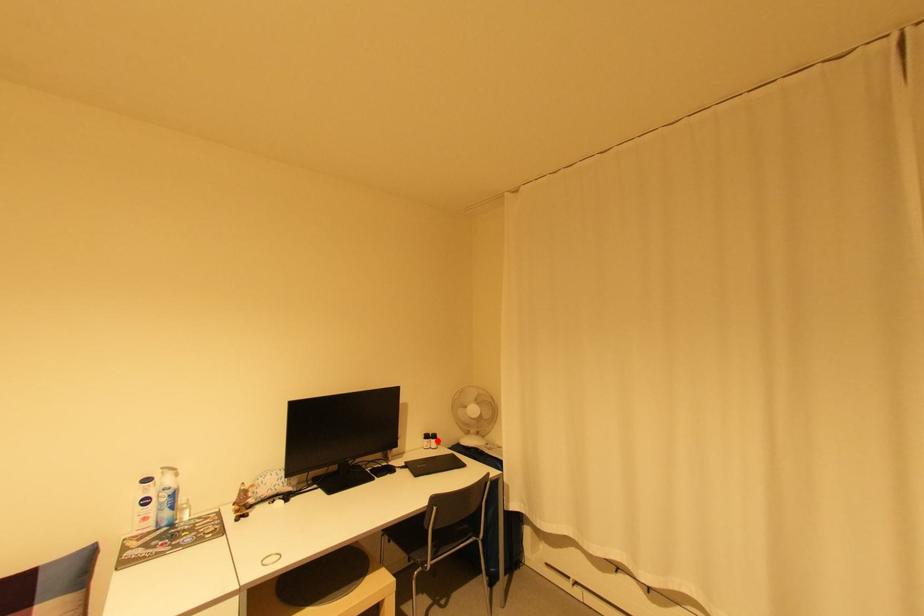
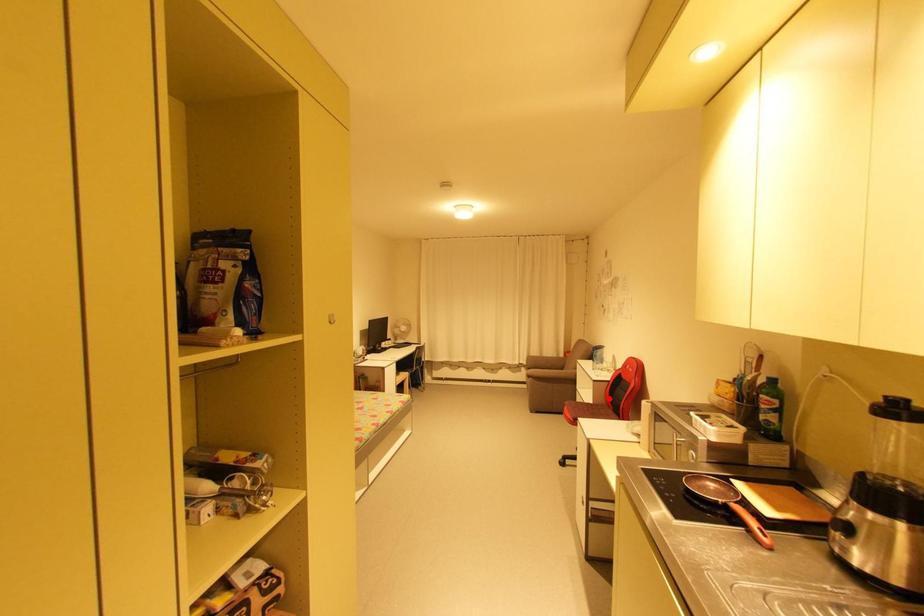
Looking at this image, I am providing you with two images of the same scene from different viewpoints. A red point is marked on the first image and another point is marked on the second image. Are the points marked in image1 and image2 representing the same 3D position?

No